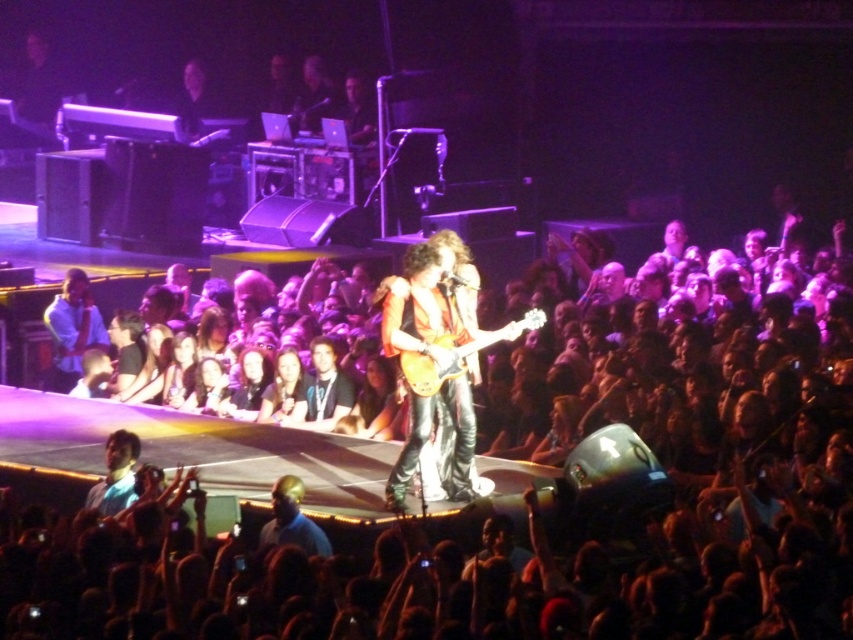
You are a photographer at the concert. You want to take a photo of the glossy wood guitar at center without the smooth skin crowd at center blocking it. Is this possible given their positions?

The smooth skin crowd at center is in front of the glossy wood guitar at center, so it would block the view. To capture the guitar without obstruction, you would need to move to a position where the crowd is not between you and the guitar.

You are a photographer at the concert. You want to take a photo of the glossy wood guitar at center without the smooth skin crowd at center blocking it. Is the crowd positioned in a way that would block the guitar in your shot?

The smooth skin crowd at center is to the right of the glossy wood guitar at center, so if you position yourself to the left side of the guitar, you can capture it without the crowd blocking it.